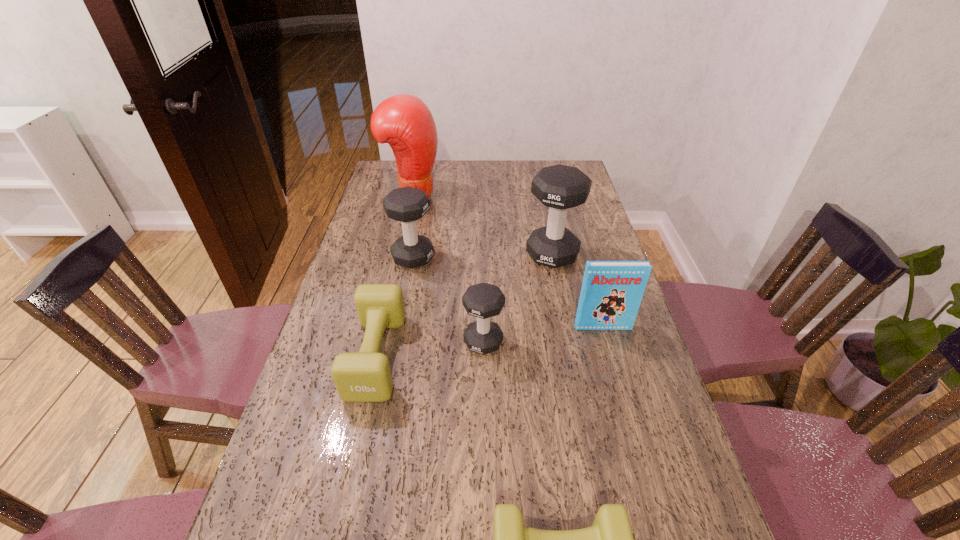
Identify the location of the bigger olive dumbbell. (365, 376).

This screenshot has width=960, height=540. In order to click on blank space located on the striking surface of the red boxing glove in this screenshot , I will do `click(505, 197)`.

Where is `blank space located 0.280m on the back of the biggest gray dumbbell`? The height and width of the screenshot is (540, 960). blank space located 0.280m on the back of the biggest gray dumbbell is located at coordinates (541, 198).

At what (x,y) coordinates should I click in order to perform the action: click on vacant area located on the right of the leftmost gray dumbbell. Please return your answer as a coordinate pair (x, y). Looking at the image, I should click on (475, 258).

You are a GUI agent. You are given a task and a screenshot of the screen. Output one action in this format:
    pyautogui.click(x=<x>, y=<y>)
    Task: Click on the vacant space located 0.070m on the front cover of the blue book
    The width and height of the screenshot is (960, 540).
    Given the screenshot: What is the action you would take?
    pyautogui.click(x=610, y=349)

Locate an element on the screen. blank space located on the left of the smallest gray dumbbell is located at coordinates (398, 342).

Where is `vacant space located 0.370m on the right of the farther olive dumbbell`? The height and width of the screenshot is (540, 960). vacant space located 0.370m on the right of the farther olive dumbbell is located at coordinates (539, 355).

I want to click on object that is at the far edge, so click(x=404, y=121).

I want to click on boxing glove positioned at the left edge, so click(x=404, y=121).

Where is `dumbbell that is at the right edge`? Image resolution: width=960 pixels, height=540 pixels. dumbbell that is at the right edge is located at coordinates coord(559,187).